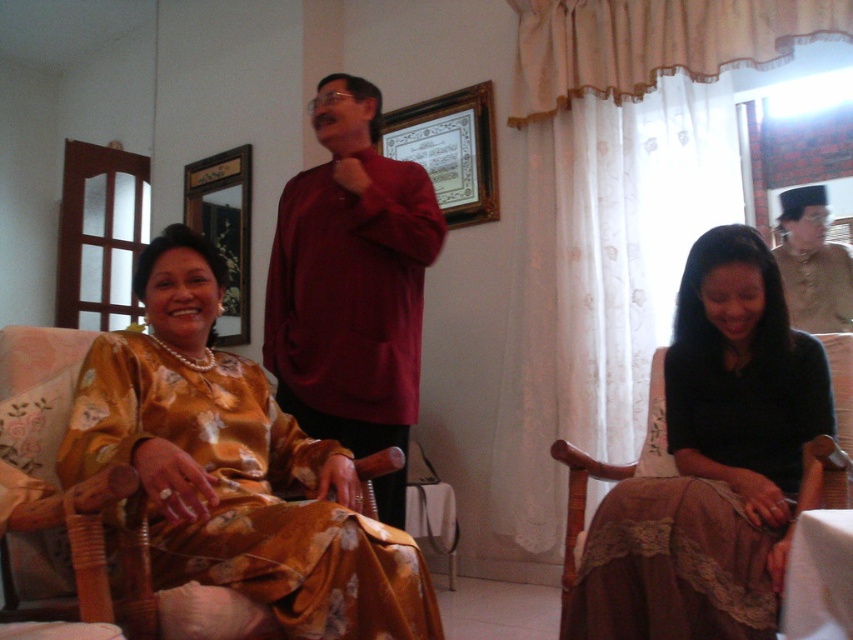
Question: Which of the following is the closest to the observer?

Choices:
 (A) matte maroon shirt at center
 (B) wooden framed picture at upper center
 (C) black lace skirt at lower right
 (D) gold satin robe at left

Answer: (D)

Question: Which object is positioned farthest from the black lace skirt at lower right?

Choices:
 (A) matte brown robe at right
 (B) wooden picture frame at upper center
 (C) wooden framed picture at upper center

Answer: (B)

Question: Which point is closer to the camera?

Choices:
 (A) (283, 250)
 (B) (737, 572)
 (C) (268, 552)
 (D) (799, 289)

Answer: (C)

Question: Can you confirm if gold satin robe at left is bigger than matte maroon shirt at center?

Choices:
 (A) no
 (B) yes

Answer: (A)

Question: Is wooden framed picture at upper center bigger than wooden picture frame at upper center?

Choices:
 (A) no
 (B) yes

Answer: (A)

Question: Is matte maroon shirt at center to the left of matte brown robe at right from the viewer's perspective?

Choices:
 (A) yes
 (B) no

Answer: (A)